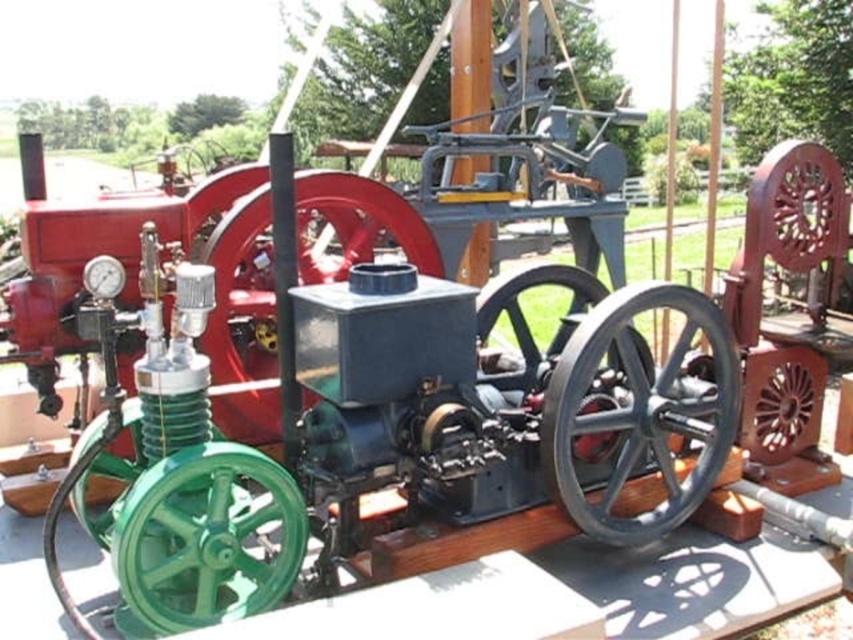
Question: Which is nearer to the green polished wood wheel at lower left?

Choices:
 (A) metallic gray gear at center
 (B) black metal wheel at center
 (C) red metal wheel at center

Answer: (C)

Question: Is black metal wheel at center to the left of green polished wood wheel at lower left from the viewer's perspective?

Choices:
 (A) yes
 (B) no

Answer: (B)

Question: Which of the following is the farthest from the observer?

Choices:
 (A) metallic gray gear at center
 (B) green polished wood wheel at lower left
 (C) black metal wheel at center
 (D) red metal wheel at center

Answer: (D)

Question: Does black metal wheel at center have a smaller size compared to metallic gray gear at center?

Choices:
 (A) no
 (B) yes

Answer: (A)

Question: Based on their relative distances, which object is farther from the black metal wheel at center?

Choices:
 (A) green polished wood wheel at lower left
 (B) metallic gray gear at center

Answer: (A)

Question: Can you confirm if red metal wheel at center is thinner than metallic gray gear at center?

Choices:
 (A) yes
 (B) no

Answer: (B)